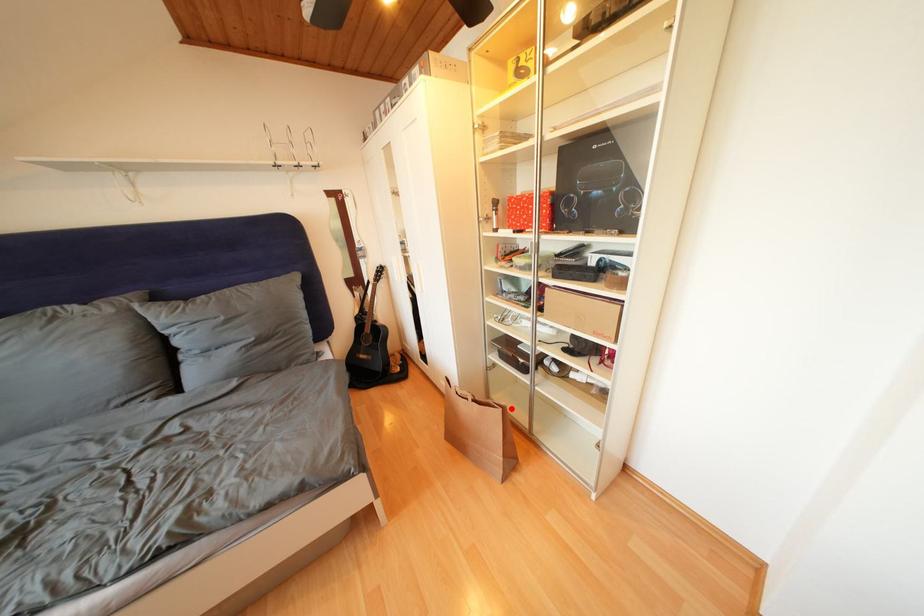
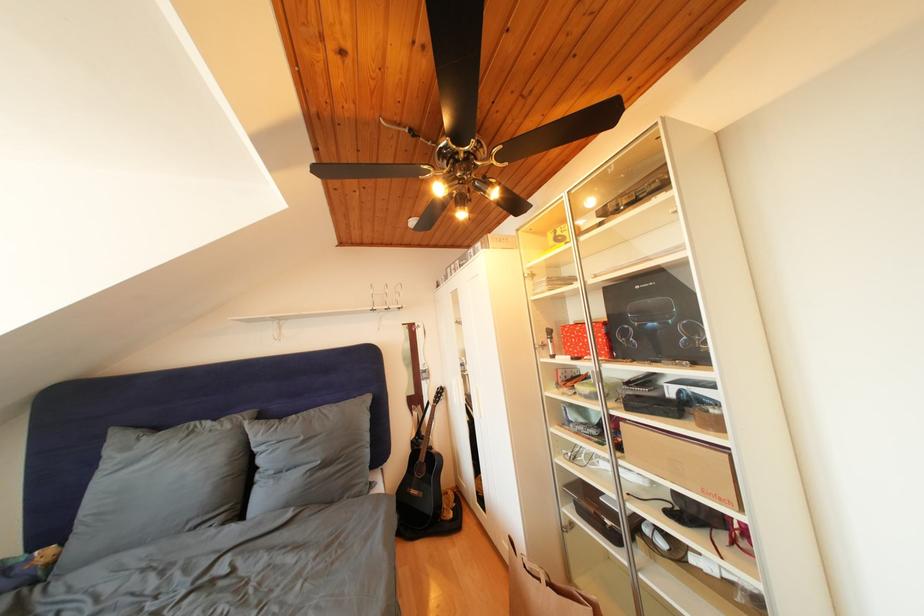
Question: I am providing you with two images of the same scene from different viewpoints. A red point is shown in image1. For the corresponding object point in image2, is it positioned nearer or farther from the camera?

Choices:
 (A) Nearer
 (B) Farther

Answer: (B)